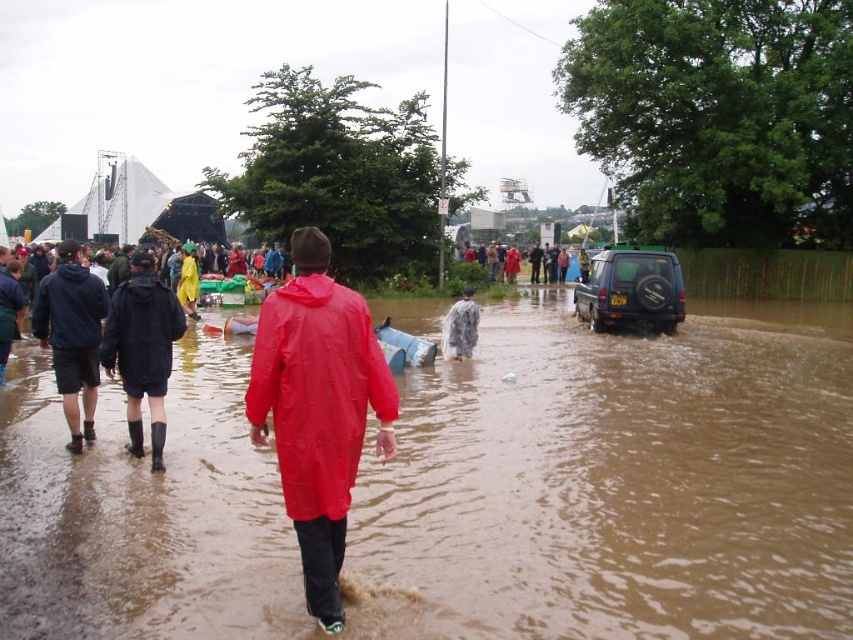
Question: Is brown matte flood at center below black rubber boots at left?

Choices:
 (A) no
 (B) yes

Answer: (B)

Question: Which object is positioned farthest from the black rubber boots at left?

Choices:
 (A) raincoat matte at center
 (B) yellow matte raincoat at center
 (C) clear plastic raincoat at center

Answer: (A)

Question: Can you confirm if dark green matte suv at right is wider than raincoat matte at center?

Choices:
 (A) no
 (B) yes

Answer: (A)

Question: Can you confirm if red matte raincoat at center is thinner than yellow matte raincoat at center?

Choices:
 (A) yes
 (B) no

Answer: (A)

Question: Which is nearer to the black rubber boots at left?

Choices:
 (A) clear plastic raincoat at center
 (B) brown matte flood at center

Answer: (B)

Question: Which point appears farthest from the camera in this image?

Choices:
 (A) (144, 272)
 (B) (44, 312)
 (C) (193, 310)

Answer: (C)